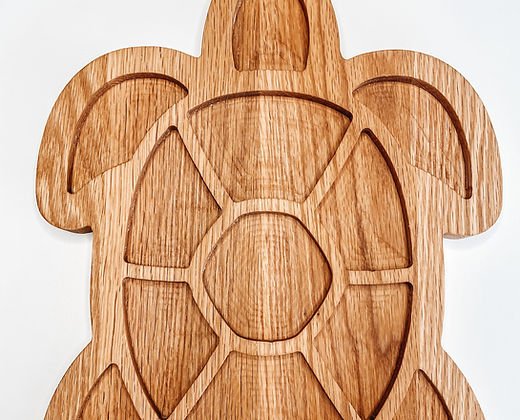
At what (x,y) coordinates should I click in order to perform the action: click on wooden turtle tray. Please return your answer as a coordinate pair (x, y). The image size is (520, 420). Looking at the image, I should click on (274, 263).